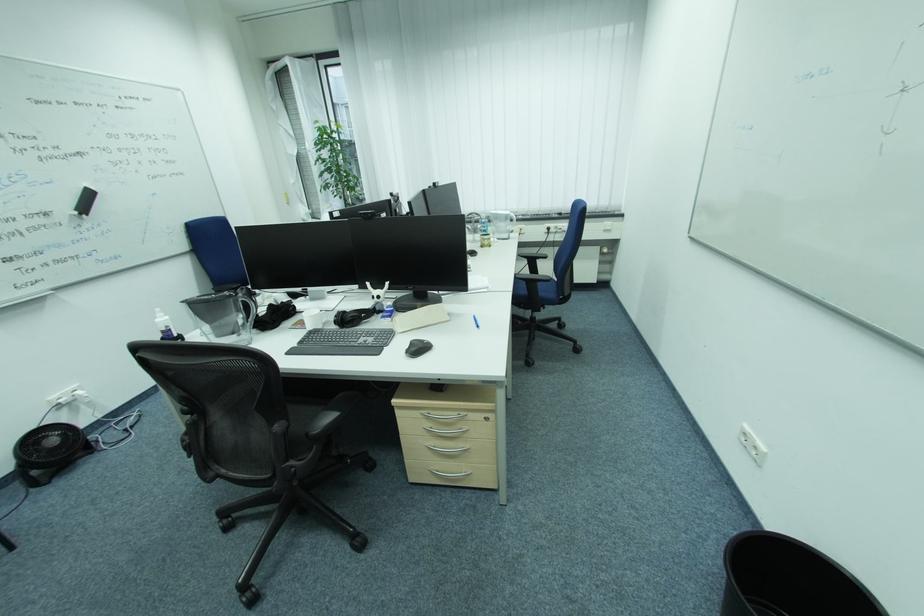
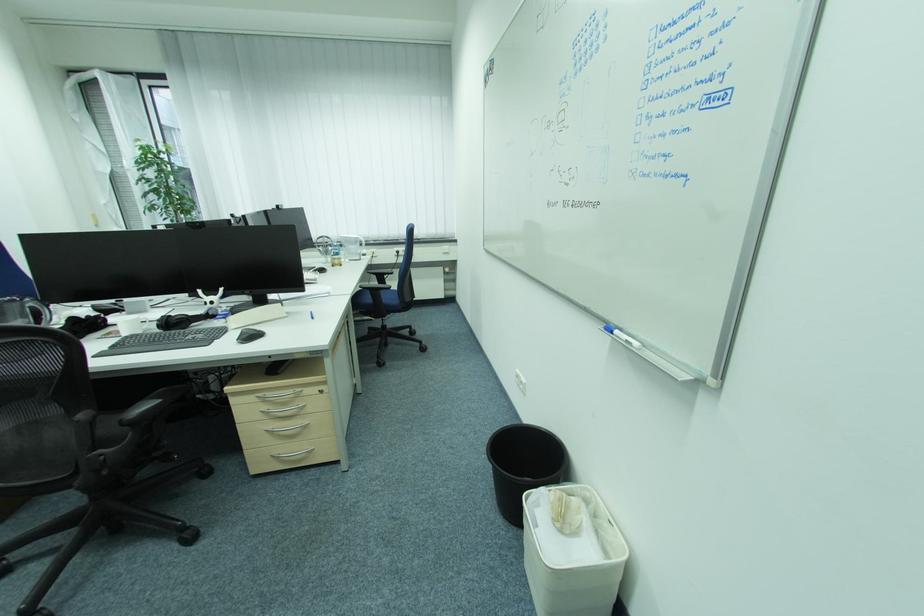
Locate, in the second image, the point that corresponds to point (529, 363) in the first image.

(381, 366)